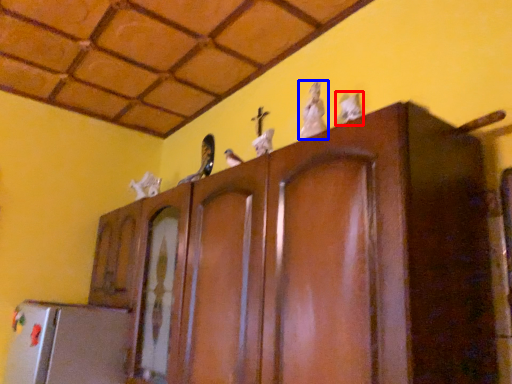
Question: Which object is further to the camera taking this photo, animal (highlighted by a red box) or animal (highlighted by a blue box)?

Choices:
 (A) animal
 (B) animal

Answer: (B)